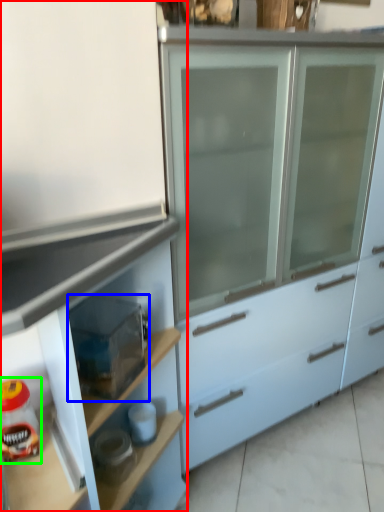
Question: Which object is the farthest from cabinetry (highlighted by a red box)? Choose among these: appliance (highlighted by a blue box) or food (highlighted by a green box).

Choices:
 (A) appliance
 (B) food

Answer: (B)